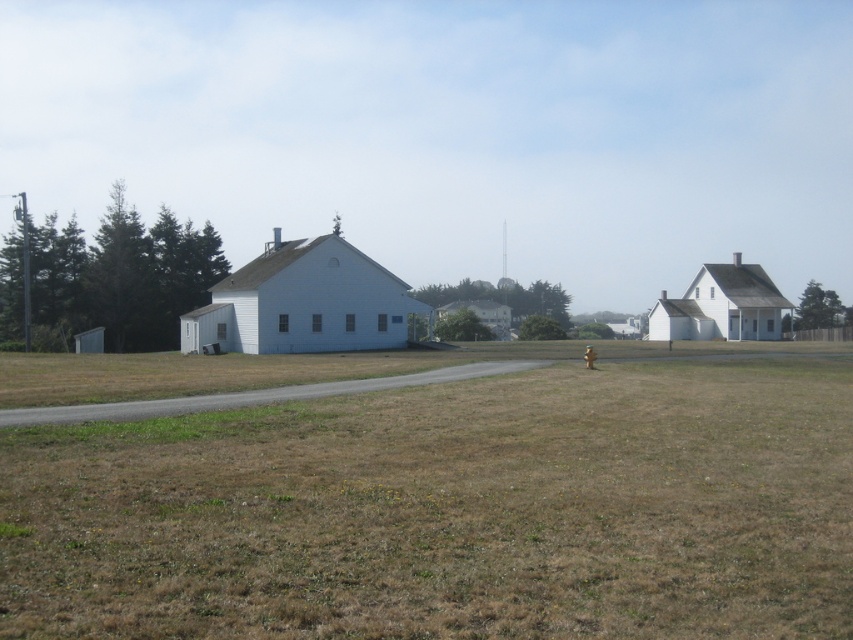
Question: Among these points, which one is nearest to the camera?

Choices:
 (A) (479, 620)
 (B) (585, 352)

Answer: (A)

Question: Can you confirm if brown grassy field at center is positioned to the left of brown matte hydrant at center?

Choices:
 (A) no
 (B) yes

Answer: (B)

Question: Which of the following is the closest to the observer?

Choices:
 (A) brown grassy field at center
 (B) brown matte hydrant at center

Answer: (A)

Question: Can you confirm if brown grassy field at center is positioned below brown matte hydrant at center?

Choices:
 (A) yes
 (B) no

Answer: (A)

Question: Is brown grassy field at center positioned behind brown matte hydrant at center?

Choices:
 (A) yes
 (B) no

Answer: (B)